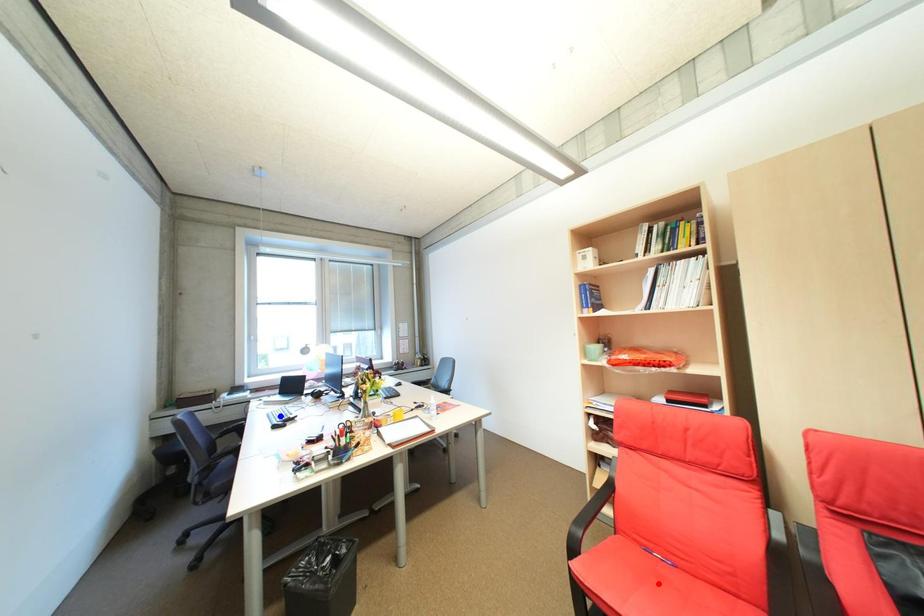
Question: Two points are marked on the image. Which point is closer to the camera?

Choices:
 (A) Blue point is closer.
 (B) Red point is closer.

Answer: (B)